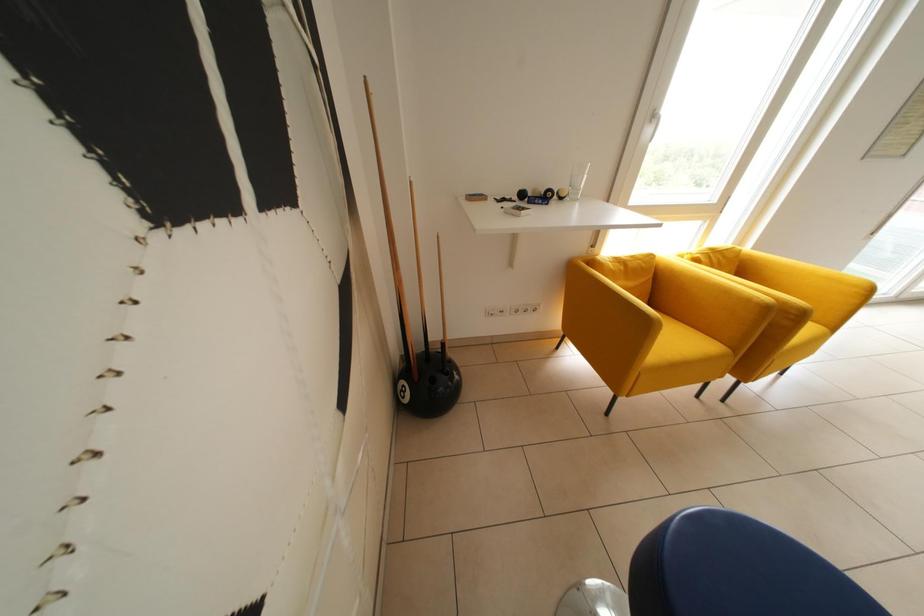
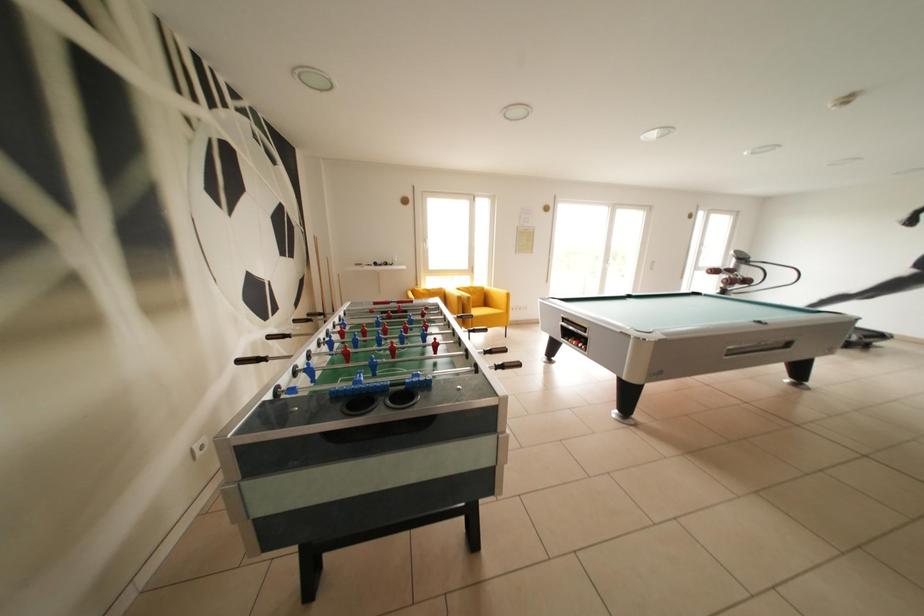
What movement of the cameraman would produce the second image?

The movement direction of the cameraman is right, backward.